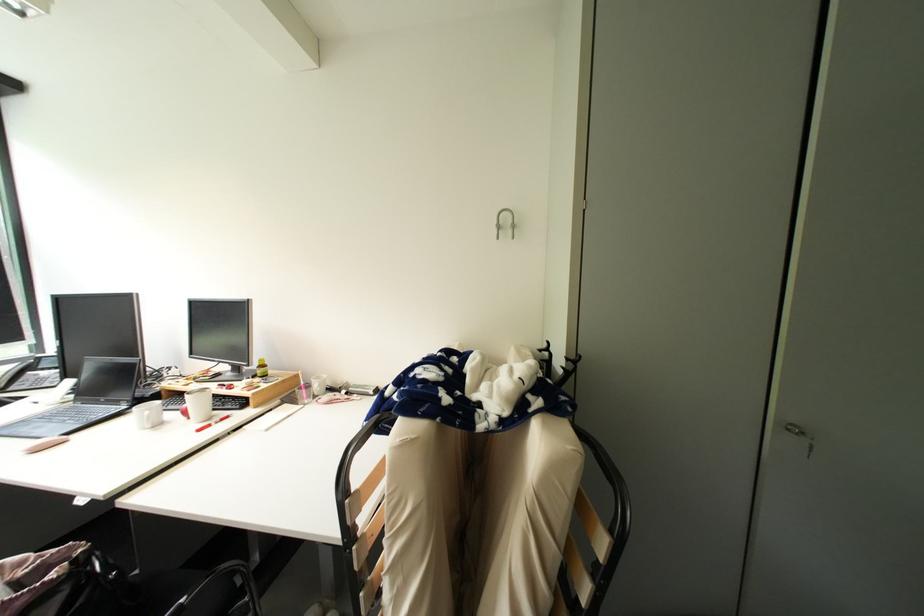
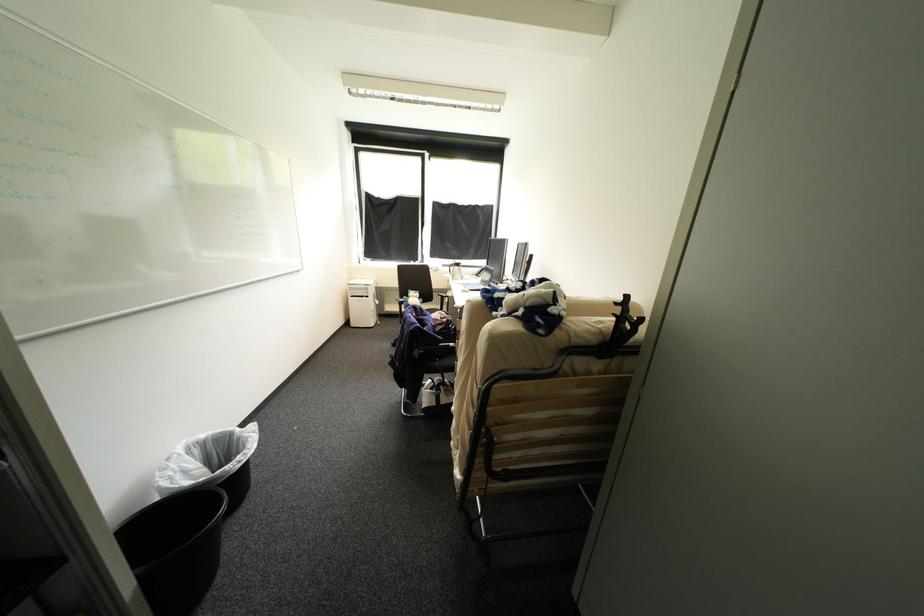
Question: The first image is from the beginning of the video and the second image is from the end. How did the camera likely rotate when shooting the video?

Choices:
 (A) Left
 (B) Right
 (C) Up
 (D) Down

Answer: (A)